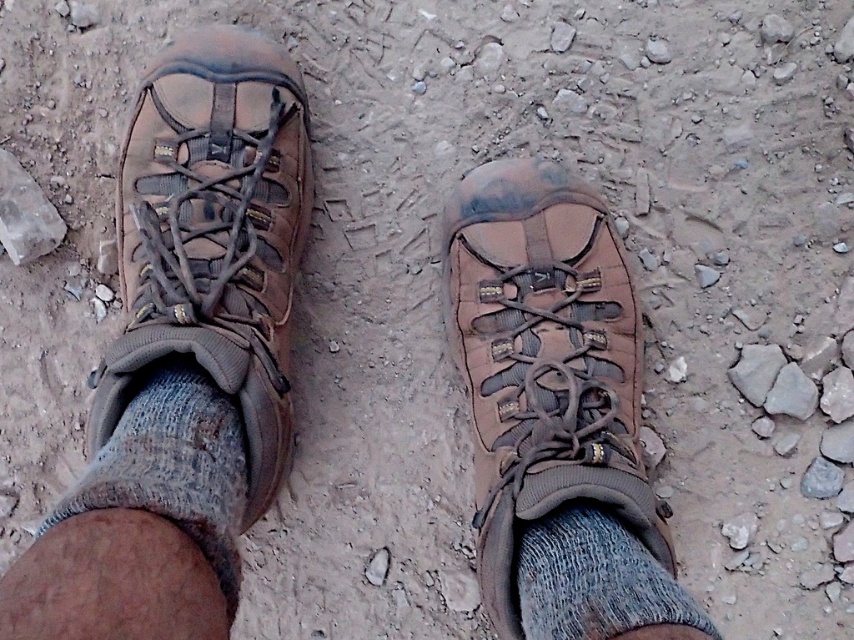
In the scene shown: You are standing in front of a hiking boot display and want to know how far the point at coordinates point (167, 122) is from the camera. Can you determine the distance?

The point at coordinates point (167, 122) is 3.79 feet away from the camera.

Consider the image. You are planning to cross a rocky trail and need to ensure your footwear is properly positioned. Based on the image, is the matte brown hiking boot at left covering the gray knitted sock at lower left?

The matte brown hiking boot at left is above the gray knitted sock at lower left, so yes, the boot is covering the sock.

You are standing in front of the image and want to locate the gray knitted sock at lower left. What are the coordinates where you can find it?

The gray knitted sock at lower left is located at coordinates point (174, 467).